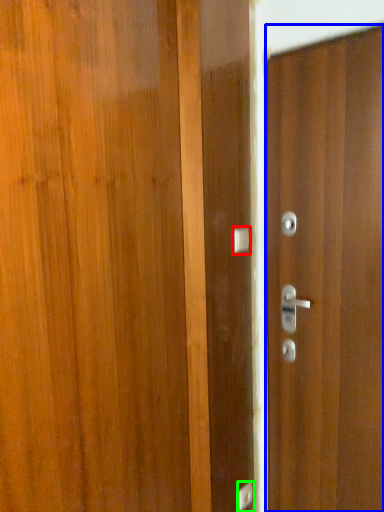
Question: Which object is the closest to the door handle (highlighted by a red box)? Choose among these: door (highlighted by a blue box) or door handle (highlighted by a green box).

Choices:
 (A) door
 (B) door handle

Answer: (A)